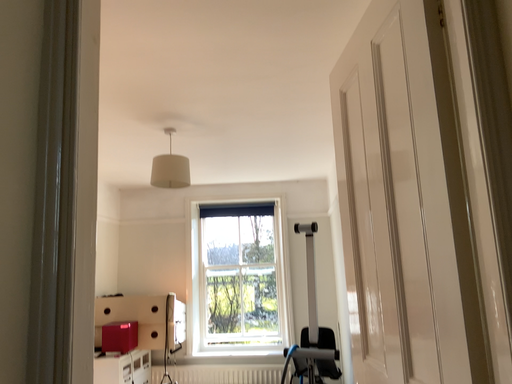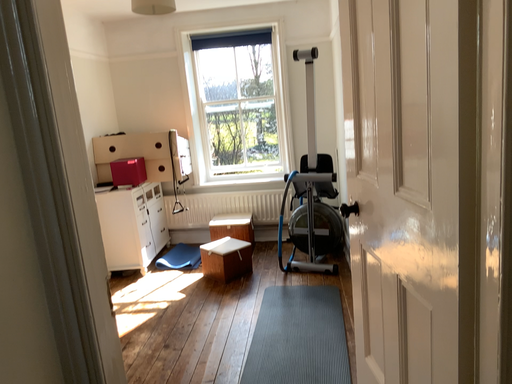
Question: How did the camera likely rotate when shooting the video?

Choices:
 (A) rotated downward
 (B) rotated upward

Answer: (A)